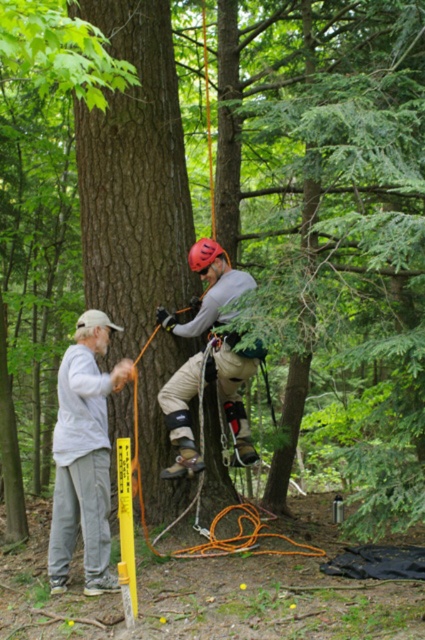
Question: Can you confirm if tan fabric harness at center is positioned to the left of rubber/matte helmet at center?

Choices:
 (A) no
 (B) yes

Answer: (A)

Question: Among these points, which one is nearest to the camera?

Choices:
 (A) (62, 465)
 (B) (214, 320)
 (C) (192, 248)

Answer: (A)

Question: Which of the following is the closest to the observer?

Choices:
 (A) (189, 252)
 (B) (85, 401)

Answer: (B)

Question: Is tan fabric harness at center above rubber/matte helmet at center?

Choices:
 (A) yes
 (B) no

Answer: (B)

Question: Which of the following is the closest to the observer?

Choices:
 (A) tan fabric harness at center
 (B) rubber/matte helmet at center
 (C) gray cotton shirt at left

Answer: (C)

Question: Considering the relative positions of tan fabric harness at center and rubber/matte helmet at center in the image provided, where is tan fabric harness at center located with respect to rubber/matte helmet at center?

Choices:
 (A) right
 (B) left

Answer: (A)